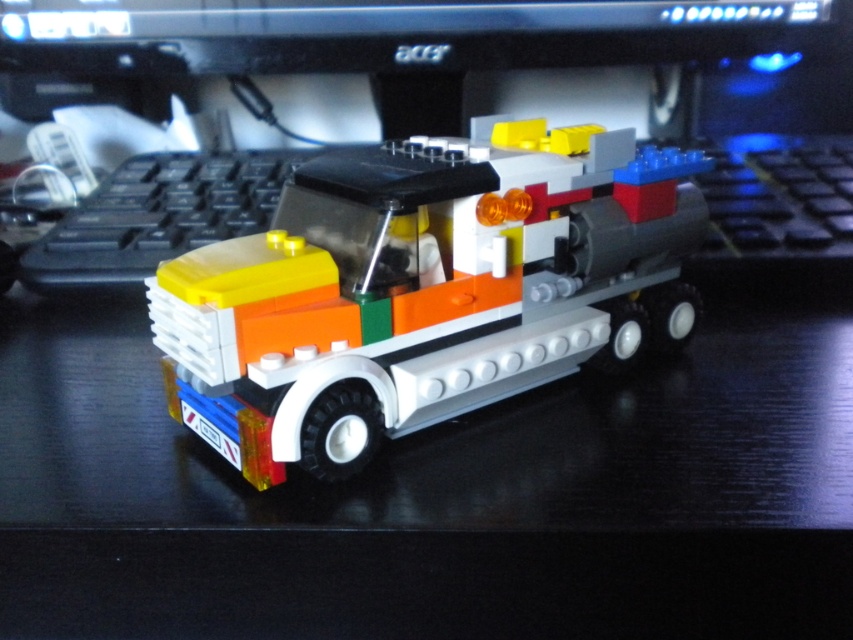
Question: Among these points, which one is nearest to the camera?

Choices:
 (A) (680, 56)
 (B) (283, 294)

Answer: (B)

Question: Does translucent orange lego truck at center have a larger size compared to black plastic computer monitor at upper center?

Choices:
 (A) no
 (B) yes

Answer: (B)

Question: Does translucent orange lego truck at center have a greater width compared to black plastic computer monitor at upper center?

Choices:
 (A) yes
 (B) no

Answer: (B)

Question: Is translucent orange lego truck at center smaller than black plastic computer monitor at upper center?

Choices:
 (A) no
 (B) yes

Answer: (A)